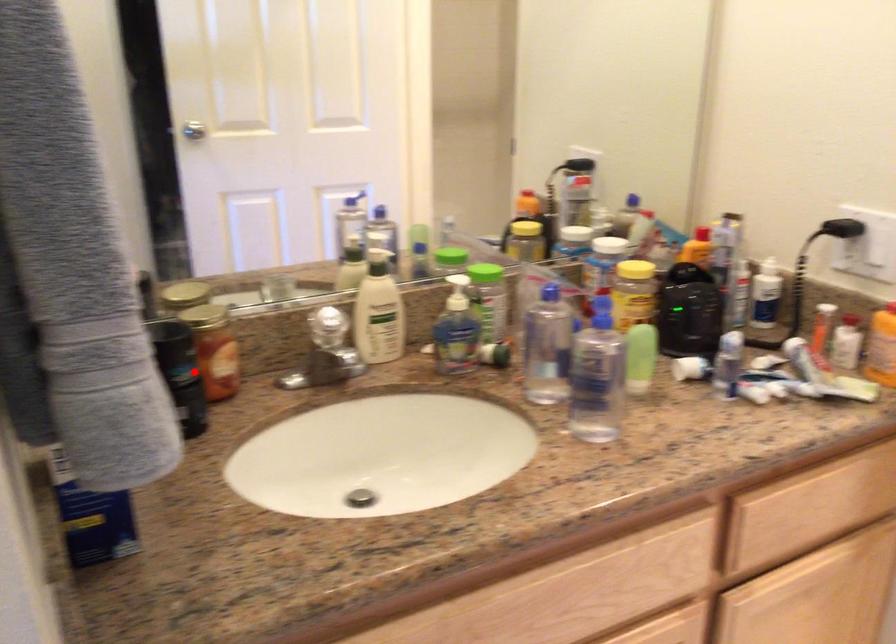
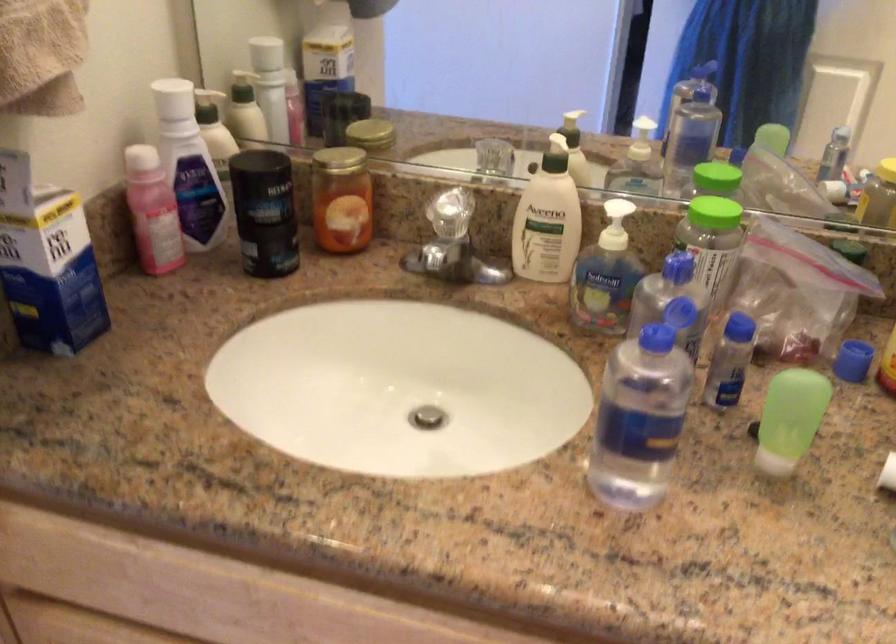
Locate, in the second image, the point that corresponds to the highlighted location in the first image.

(264, 212)